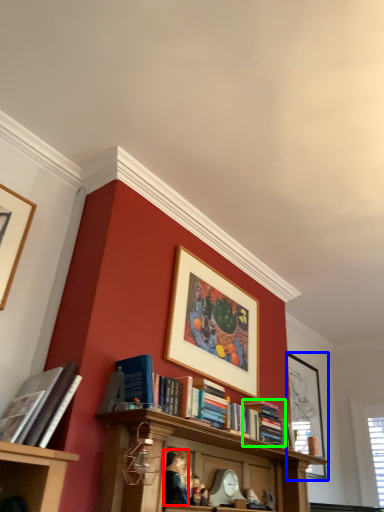
Question: Considering the real-world distances, which object is closest to person (highlighted by a red box)? picture frame (highlighted by a blue box) or book (highlighted by a green box).

Choices:
 (A) picture frame
 (B) book

Answer: (B)